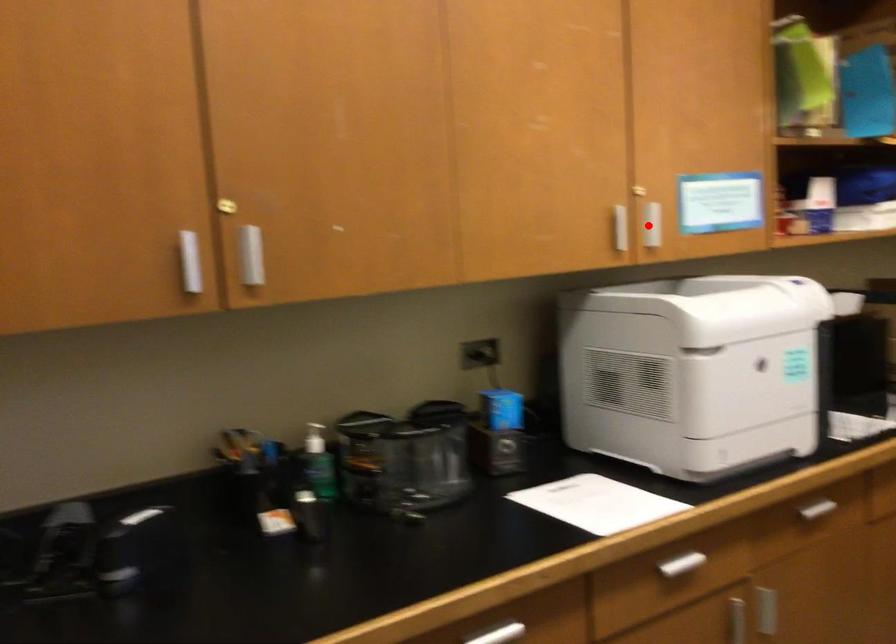
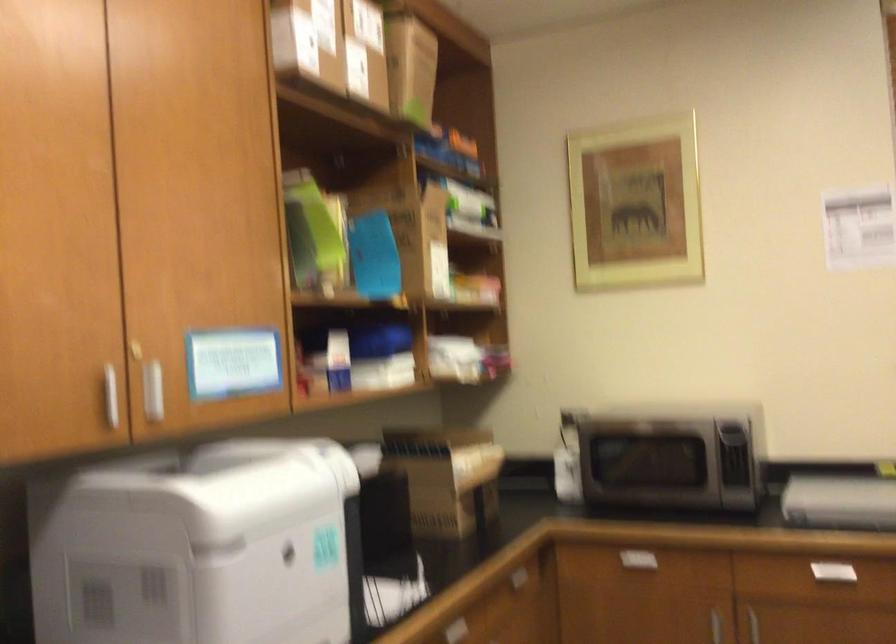
Locate, in the second image, the point that corresponds to the highlighted location in the first image.

(152, 391)